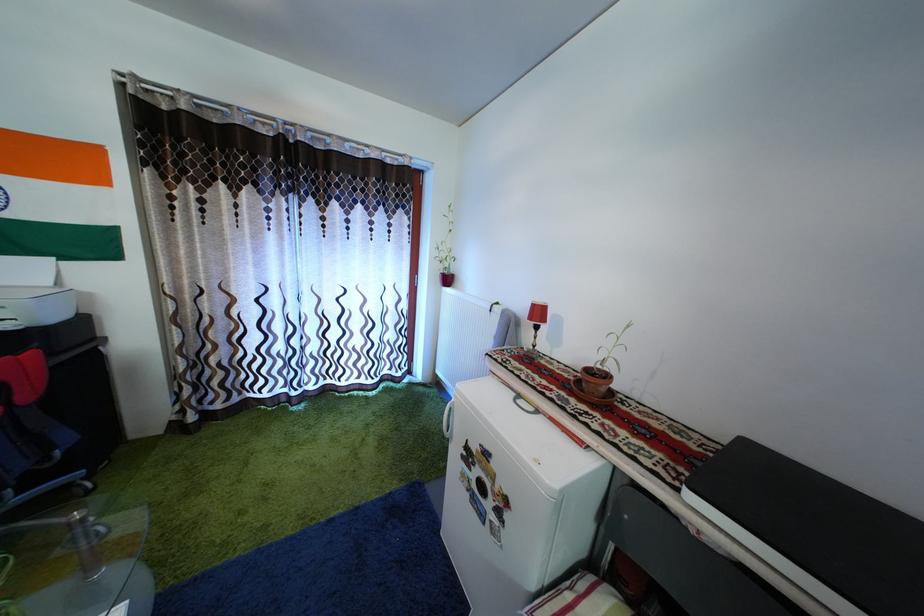
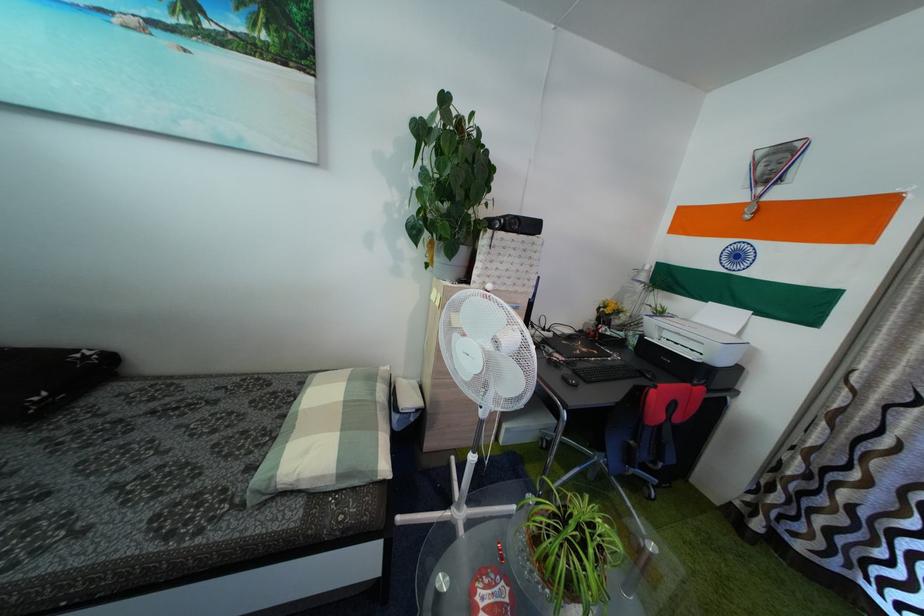
Question: How did the camera likely rotate?

Choices:
 (A) Left
 (B) Right
 (C) Up
 (D) Down

Answer: (A)